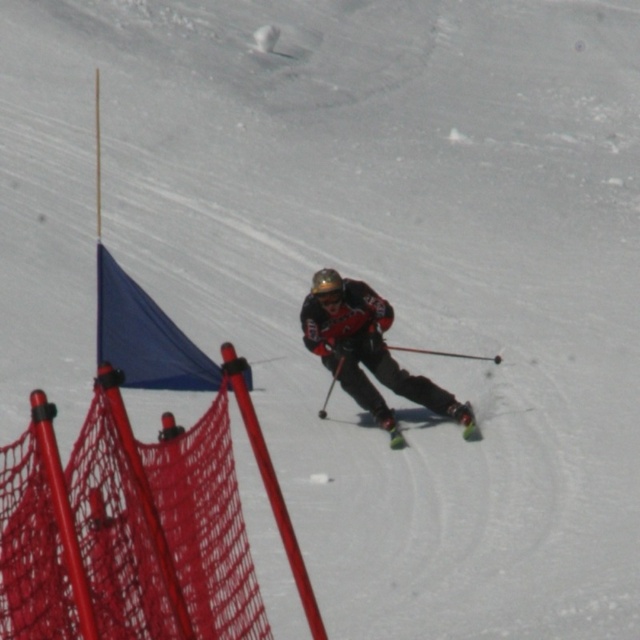
Where is `matte black ski suit at center`? Image resolution: width=640 pixels, height=640 pixels. matte black ski suit at center is located at coordinates (368, 352).

Describe the element at coordinates (368, 352) in the screenshot. I see `matte black ski suit at center` at that location.

Locate an element on the screen. This screenshot has height=640, width=640. matte black ski suit at center is located at coordinates (368, 352).

At what (x,y) coordinates should I click in order to perform the action: click on matte black ski suit at center. Please return your answer as a coordinate pair (x, y). The image size is (640, 640). Looking at the image, I should click on (368, 352).